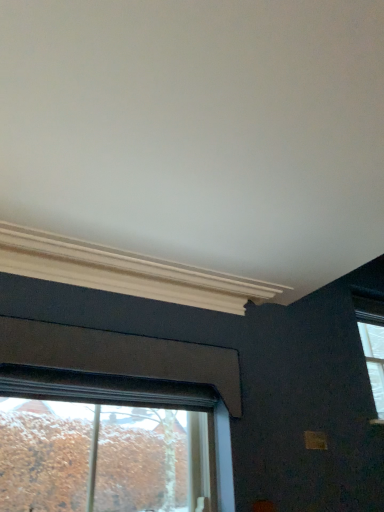
Image resolution: width=384 pixels, height=512 pixels. Describe the element at coordinates (112, 445) in the screenshot. I see `clear glass window at lower left` at that location.

Locate an element on the screen. The height and width of the screenshot is (512, 384). clear glass window at lower left is located at coordinates (112, 445).

At what (x,y) coordinates should I click in order to perform the action: click on clear glass window at lower left. Please return your answer as a coordinate pair (x, y). This screenshot has height=512, width=384. Looking at the image, I should click on (112, 445).